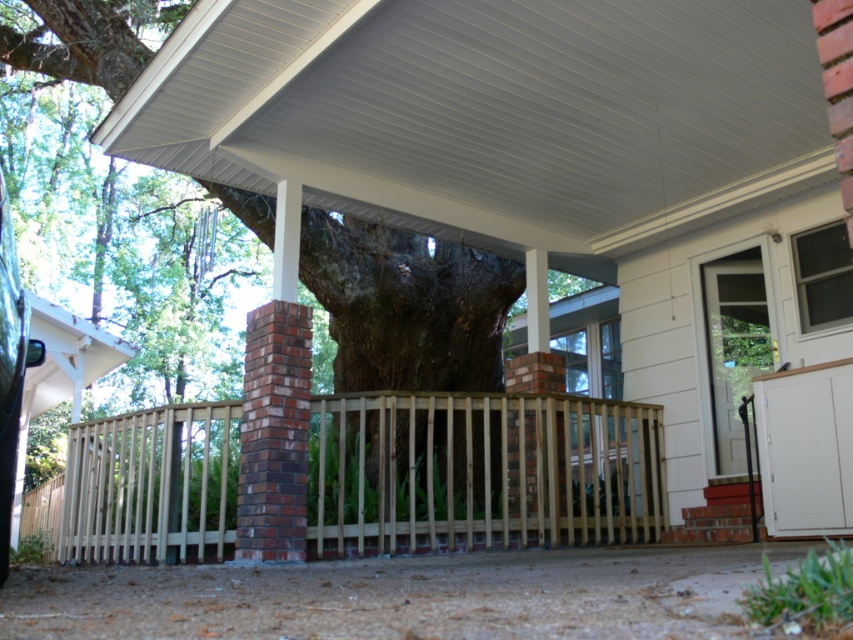
Is white corrugated metal roof at upper center taller than light brown wooden fence at center?

No.

Does white corrugated metal roof at upper center have a greater width compared to light brown wooden fence at center?

No.

Identify the location of white corrugated metal roof at upper center. pyautogui.click(x=492, y=113).